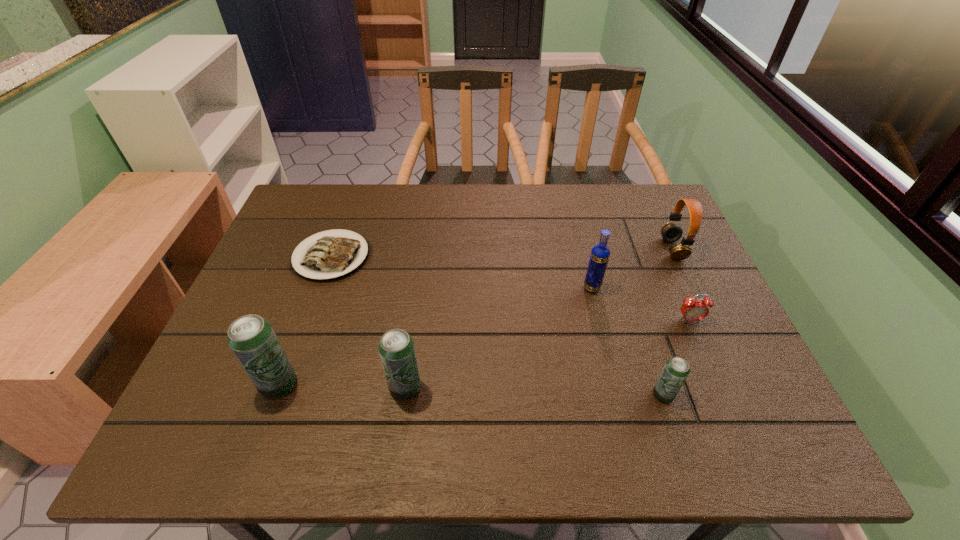
The image size is (960, 540). What are the coordinates of `the leftmost beer can` in the screenshot? It's located at (251, 338).

Locate an element on the screen. This screenshot has width=960, height=540. the second beer can from right to left is located at coordinates (396, 348).

The width and height of the screenshot is (960, 540). I want to click on the second tallest beer can, so click(396, 348).

Locate an element on the screen. the fifth object from left to right is located at coordinates (676, 369).

The image size is (960, 540). Identify the location of the rightmost beer can. (676, 369).

Image resolution: width=960 pixels, height=540 pixels. Find the location of `headset`. headset is located at coordinates (671, 232).

In order to click on the fourth object from right to left in this screenshot , I will do `click(599, 257)`.

You are a GUI agent. You are given a task and a screenshot of the screen. Output one action in this format:
    pyautogui.click(x=<x>, y=<y>)
    Task: Click on the alarm clock
    
    Given the screenshot: What is the action you would take?
    pyautogui.click(x=692, y=310)

Where is `the second shortest object`? Image resolution: width=960 pixels, height=540 pixels. the second shortest object is located at coordinates (692, 310).

In order to click on plate in this screenshot , I will do `click(332, 256)`.